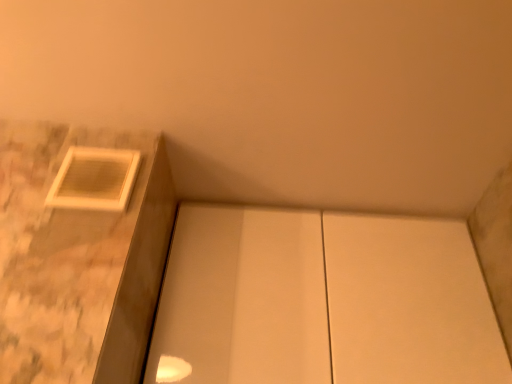
Question: Does matte white frame at upper left have a greater height compared to white matte cabinet at center?

Choices:
 (A) no
 (B) yes

Answer: (A)

Question: Is matte white frame at upper left with white matte cabinet at center?

Choices:
 (A) yes
 (B) no

Answer: (B)

Question: Considering the relative sizes of matte white frame at upper left and white matte cabinet at center in the image provided, is matte white frame at upper left thinner than white matte cabinet at center?

Choices:
 (A) no
 (B) yes

Answer: (B)

Question: Is matte white frame at upper left to the left of white matte cabinet at center from the viewer's perspective?

Choices:
 (A) yes
 (B) no

Answer: (A)

Question: Is the position of matte white frame at upper left more distant than that of white matte cabinet at center?

Choices:
 (A) no
 (B) yes

Answer: (A)

Question: Considering the relative sizes of matte white frame at upper left and white matte cabinet at center in the image provided, is matte white frame at upper left shorter than white matte cabinet at center?

Choices:
 (A) no
 (B) yes

Answer: (B)

Question: From the image's perspective, is white matte cabinet at center located beneath matte white frame at upper left?

Choices:
 (A) no
 (B) yes

Answer: (B)

Question: Is the depth of white matte cabinet at center greater than that of matte white frame at upper left?

Choices:
 (A) yes
 (B) no

Answer: (A)

Question: Are white matte cabinet at center and matte white frame at upper left making contact?

Choices:
 (A) no
 (B) yes

Answer: (A)

Question: From a real-world perspective, is white matte cabinet at center below matte white frame at upper left?

Choices:
 (A) yes
 (B) no

Answer: (A)

Question: Considering the relative sizes of white matte cabinet at center and matte white frame at upper left in the image provided, is white matte cabinet at center wider than matte white frame at upper left?

Choices:
 (A) no
 (B) yes

Answer: (B)

Question: From a real-world perspective, is white matte cabinet at center positioned over matte white frame at upper left based on gravity?

Choices:
 (A) no
 (B) yes

Answer: (A)

Question: Visually, is white matte cabinet at center positioned to the left or to the right of matte white frame at upper left?

Choices:
 (A) right
 (B) left

Answer: (A)